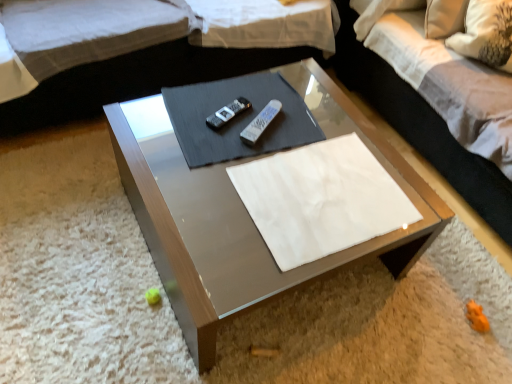
I want to click on vacant space that is in between white plastic remote at center, which is the second remote from left to right, and white paper at center, so click(292, 135).